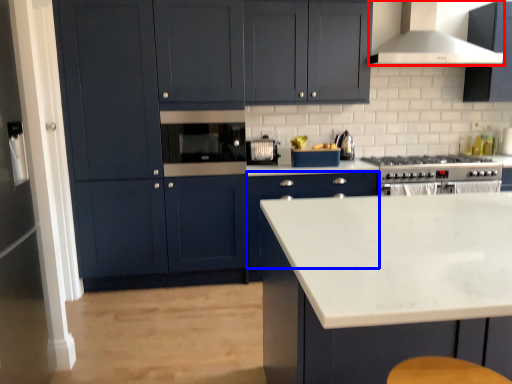
Question: Which object appears farthest to the camera in this image, home appliance (highlighted by a red box) or cabinetry (highlighted by a blue box)?

Choices:
 (A) home appliance
 (B) cabinetry

Answer: (B)